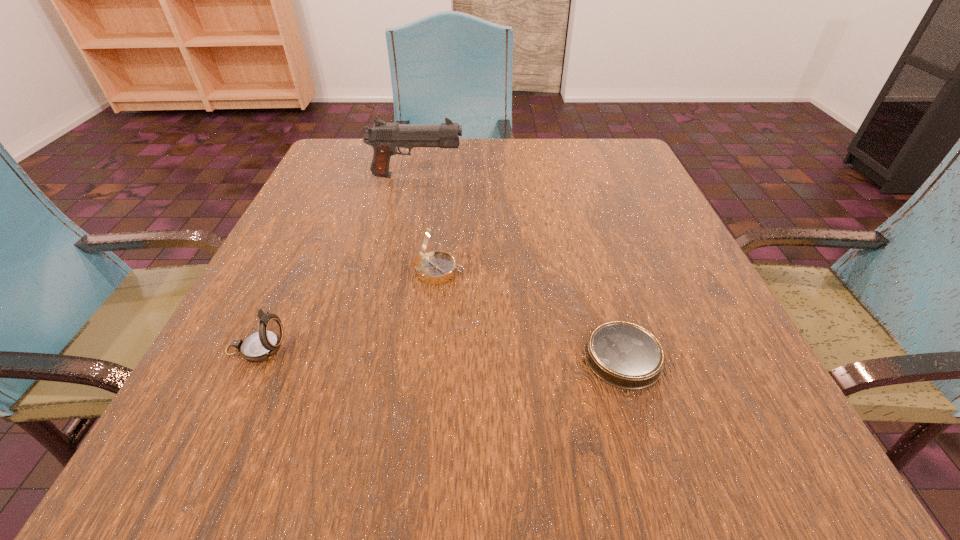
The width and height of the screenshot is (960, 540). What are the coordinates of `the tallest object` in the screenshot? It's located at pyautogui.click(x=384, y=137).

Identify the location of gun. (384, 137).

Where is `the second farthest object`? the second farthest object is located at coordinates (435, 267).

You are a GUI agent. You are given a task and a screenshot of the screen. Output one action in this format:
    pyautogui.click(x=<x>, y=<y>)
    Task: Click on the farthest compass
    The height and width of the screenshot is (540, 960).
    Given the screenshot: What is the action you would take?
    pyautogui.click(x=435, y=267)

The height and width of the screenshot is (540, 960). In order to click on the leftmost compass in this screenshot , I will do `click(262, 345)`.

This screenshot has width=960, height=540. Find the location of `the shortest compass`. the shortest compass is located at coordinates (624, 355).

You are a GUI agent. You are given a task and a screenshot of the screen. Output one action in this format:
    pyautogui.click(x=<x>, y=<y>)
    Task: Click on the rightmost object
    This screenshot has width=960, height=540.
    Given the screenshot: What is the action you would take?
    pyautogui.click(x=624, y=355)

Identify the location of vacant space situated 0.200m in the direction the tallest object is aimed. coord(551,176).

At what (x,y) coordinates should I click in order to perform the action: click on vacant region located with the dial facing the third nearest object. Please return your answer as a coordinate pair (x, y). This screenshot has height=540, width=960. Looking at the image, I should click on (588, 271).

Find the location of a particular element. The height and width of the screenshot is (540, 960). free spot located 0.220m on the face of the leftmost compass is located at coordinates (440, 349).